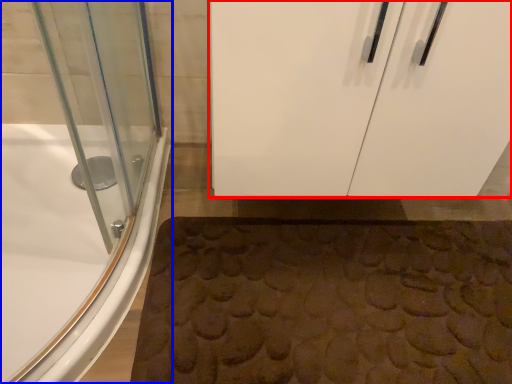
Question: Which of the following is the farthest to the observer, door (highlighted by a red box) or bathtub (highlighted by a blue box)?

Choices:
 (A) door
 (B) bathtub

Answer: (B)